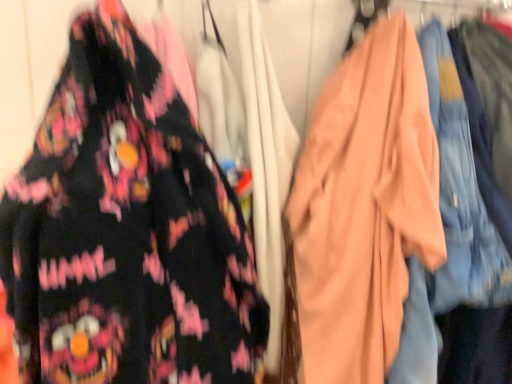
Question: Based on their sizes in the image, would you say matte black shirt at left is bigger or smaller than matte peach robe at center?

Choices:
 (A) small
 (B) big

Answer: (A)

Question: Considering the positions of matte black shirt at left and matte peach robe at center in the image, is matte black shirt at left wider or thinner than matte peach robe at center?

Choices:
 (A) thin
 (B) wide

Answer: (A)

Question: From a real-world perspective, is matte black shirt at left positioned above or below matte peach robe at center?

Choices:
 (A) below
 (B) above

Answer: (B)

Question: Considering the positions of matte peach robe at center and matte black shirt at left in the image, is matte peach robe at center wider or thinner than matte black shirt at left?

Choices:
 (A) wide
 (B) thin

Answer: (A)

Question: From their relative heights in the image, would you say matte peach robe at center is taller or shorter than matte black shirt at left?

Choices:
 (A) short
 (B) tall

Answer: (B)

Question: From a real-world perspective, is matte peach robe at center physically located above or below matte black shirt at left?

Choices:
 (A) below
 (B) above

Answer: (A)

Question: Visually, is matte peach robe at center positioned to the left or to the right of matte black shirt at left?

Choices:
 (A) left
 (B) right

Answer: (B)